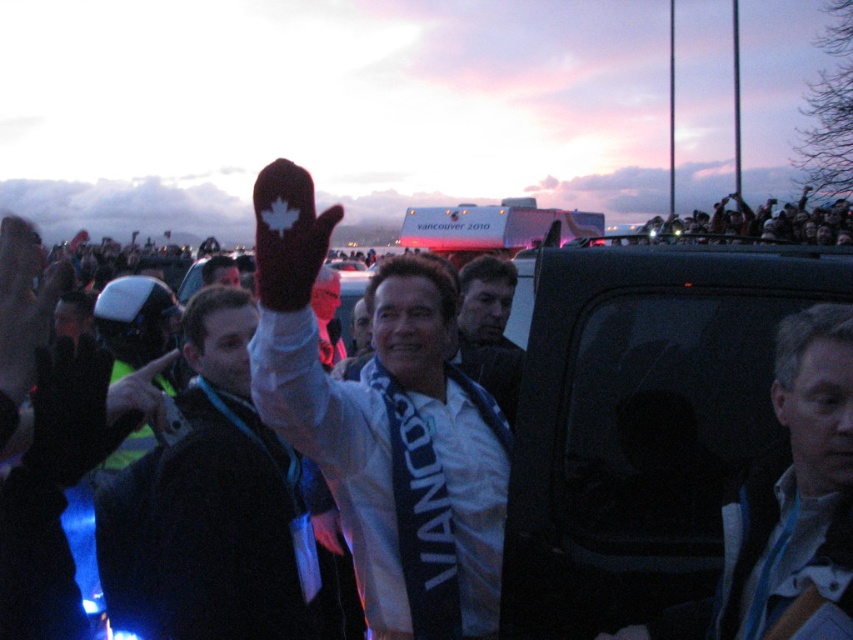
Is point (277, 589) positioned before point (827, 556)?

No, (277, 589) is behind (827, 556).

Does point (138, 628) come in front of point (840, 557)?

No.

Locate an element on the screen. This screenshot has width=853, height=640. dark blue fabric jacket at upper left is located at coordinates (210, 506).

Between light blue fabric scarf at center and dark blue fabric shirt at center, which one appears on the right side from the viewer's perspective?

Positioned to the right is light blue fabric scarf at center.

Between point (764, 632) and point (471, 337), which one is positioned in front?

Point (764, 632) is in front.

The image size is (853, 640). Find the location of `light blue fabric scarf at center`. light blue fabric scarf at center is located at coordinates (798, 483).

Locate an element on the screen. The height and width of the screenshot is (640, 853). light blue fabric scarf at center is located at coordinates (798, 483).

Does matte red mitten at center have a lesser height compared to dark blue fabric shirt at center?

No.

Locate an element on the screen. The width and height of the screenshot is (853, 640). matte red mitten at center is located at coordinates (374, 406).